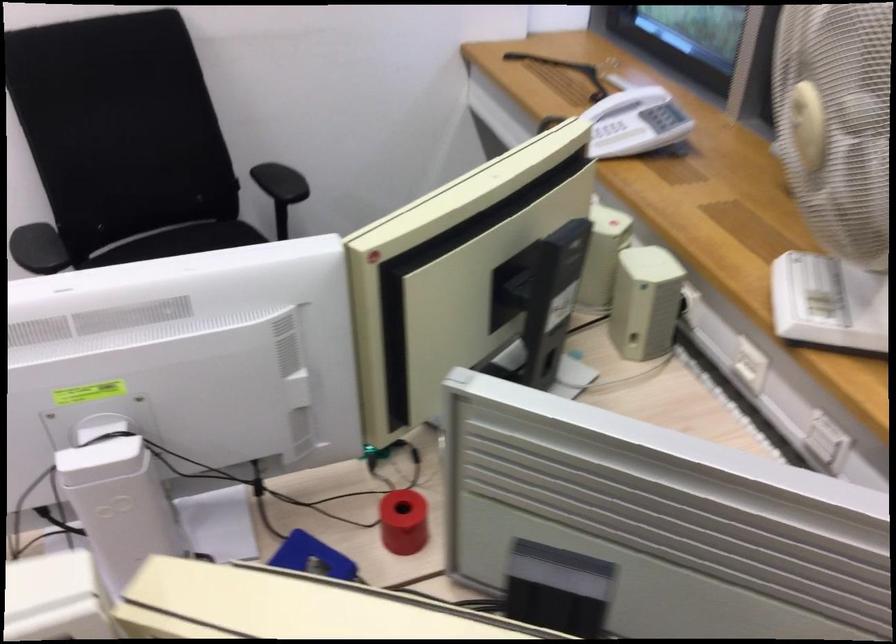
What do you see at coordinates (807, 125) in the screenshot?
I see `the fan oscillation knob` at bounding box center [807, 125].